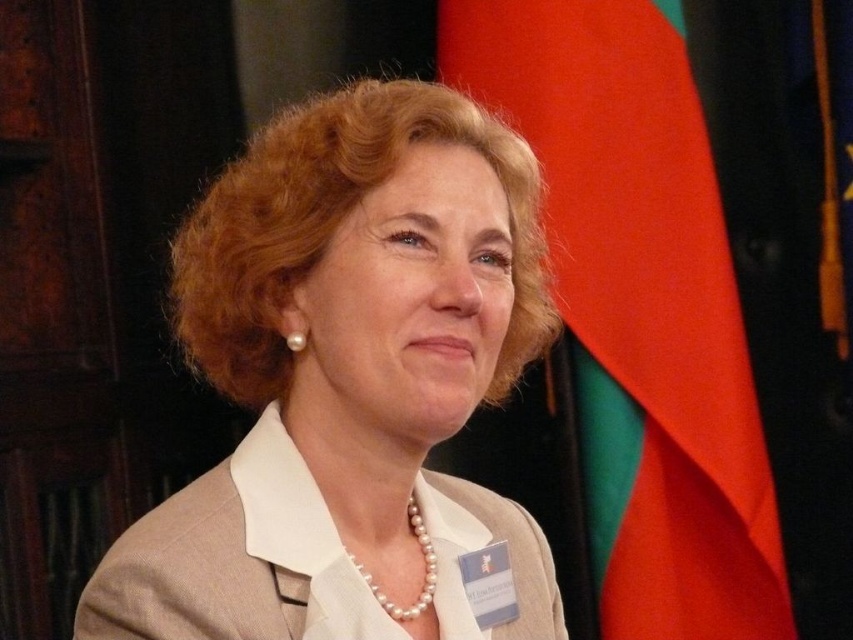
You are a photographer at a formal event. You need to place a new decorative item exactly where the red fabric flag at right is currently located. What are the coordinates of the spot where you should place the new item?

The coordinates for the red fabric flag at right are at point (640, 308), so you should place the new item there.

You are a photographer adjusting the lighting for a professional portrait. You notice two beige suits in the image, the matte beige suit at center and the beige fabric business suit at center. Which one is closer to the camera?

The matte beige suit at center is closer to the camera since it is only 2.55 inches away from the beige fabric business suit at center.

You are a photographer at a diplomatic event. You need to capture a photo where the red fabric flag at right is visible above the pearl necklace at center. Is this possible based on their positions in the image?

Yes, the red fabric flag at right is positioned above the pearl necklace at center, so capturing the photo as described is possible.